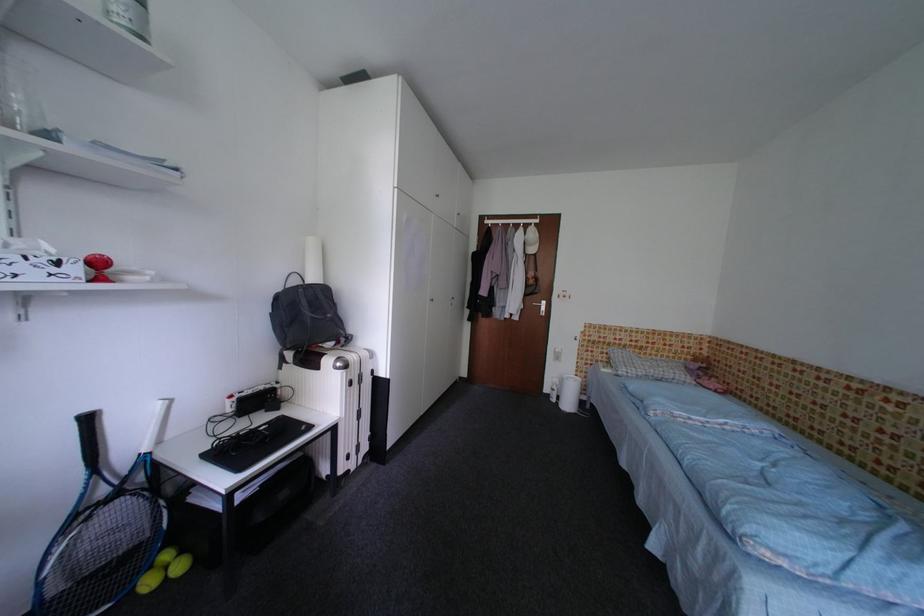
The height and width of the screenshot is (616, 924). In order to click on white cap in this screenshot , I will do `click(530, 240)`.